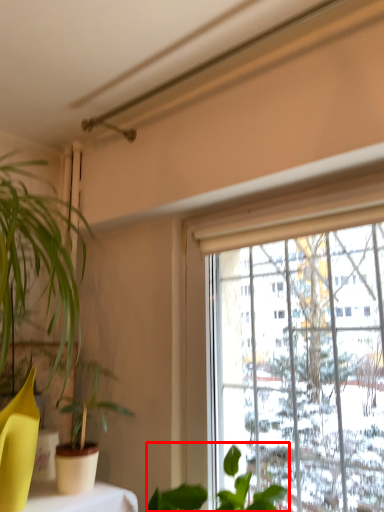
Question: Where is houseplant (annotated by the red box) located in relation to houseplant in the image?

Choices:
 (A) right
 (B) left

Answer: (A)